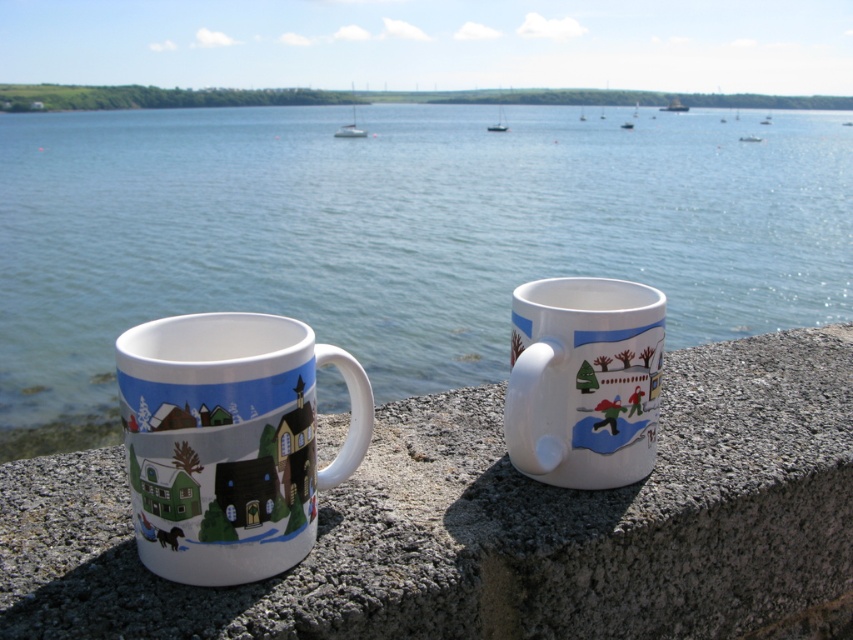
You are standing on a balcony and notice two items on the ledge. You want to place a new potted plant between the white glossy mug at left and the white glossy sailboat at center. Can you fit it there?

The white glossy mug at left is positioned under the white glossy sailboat at center, meaning there is space between them on the ledge. Therefore, you can fit a potted plant between the white glossy mug at left and the white glossy sailboat at center.

You are standing in front of two points marked on a map of the area. The points are labeled as point (x=202, y=589) and point (x=682, y=108). Which point is closer to you?

Point (x=202, y=589) is closer to the viewer than point (x=682, y=108).

You are a painter who wants to place a large canvas on the granite ledge at center and the metallic silver boat at upper center. Which object can accommodate the canvas better based on their sizes?

The granite ledge at center is larger in size than the metallic silver boat at upper center, so the canvas can be placed on the granite ledge at center better.